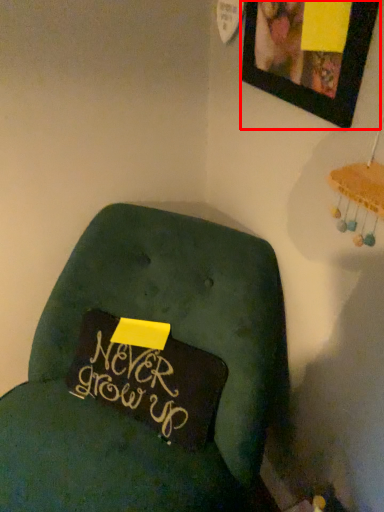
Question: From the image's perspective, where is picture frame (annotated by the red box) located relative to furniture?

Choices:
 (A) below
 (B) above

Answer: (B)